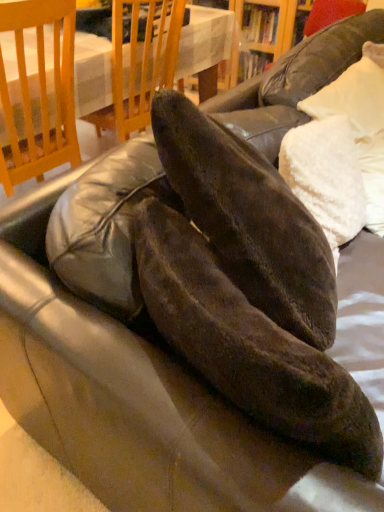
Question: Is wooden table at upper center directly adjacent to white fluffy pillow at upper right?

Choices:
 (A) yes
 (B) no

Answer: (B)

Question: Is wooden table at upper center to the left of white fluffy pillow at upper right from the viewer's perspective?

Choices:
 (A) no
 (B) yes

Answer: (B)

Question: Is white fluffy pillow at upper right at the back of wooden table at upper center?

Choices:
 (A) yes
 (B) no

Answer: (A)

Question: From a real-world perspective, is wooden table at upper center beneath white fluffy pillow at upper right?

Choices:
 (A) yes
 (B) no

Answer: (A)

Question: Does wooden table at upper center have a lesser height compared to white fluffy pillow at upper right?

Choices:
 (A) yes
 (B) no

Answer: (B)

Question: Considering the positions of point (359, 173) and point (243, 298), is point (359, 173) closer or farther from the camera than point (243, 298)?

Choices:
 (A) farther
 (B) closer

Answer: (A)

Question: From their relative heights in the image, would you say white fluffy pillow at upper right is taller or shorter than matte black shoe at center?

Choices:
 (A) tall
 (B) short

Answer: (B)

Question: Looking at the image, does white fluffy pillow at upper right seem bigger or smaller compared to matte black shoe at center?

Choices:
 (A) small
 (B) big

Answer: (A)

Question: Is white fluffy pillow at upper right inside the boundaries of matte black shoe at center, or outside?

Choices:
 (A) inside
 (B) outside

Answer: (B)

Question: In the image, is matte black shoe at center positioned in front of or behind wooden table at upper center?

Choices:
 (A) behind
 (B) front

Answer: (B)

Question: From their relative heights in the image, would you say matte black shoe at center is taller or shorter than wooden table at upper center?

Choices:
 (A) short
 (B) tall

Answer: (A)

Question: From the image's perspective, is matte black shoe at center located above or below wooden table at upper center?

Choices:
 (A) above
 (B) below

Answer: (B)

Question: From a real-world perspective, relative to wooden table at upper center, is matte black shoe at center vertically above or below?

Choices:
 (A) above
 (B) below

Answer: (A)

Question: Considering their positions, is wooden table at upper center located in front of or behind white fluffy pillow at upper right?

Choices:
 (A) front
 (B) behind

Answer: (B)

Question: Considering the positions of point (100, 69) and point (347, 173), is point (100, 69) closer or farther from the camera than point (347, 173)?

Choices:
 (A) closer
 (B) farther

Answer: (B)